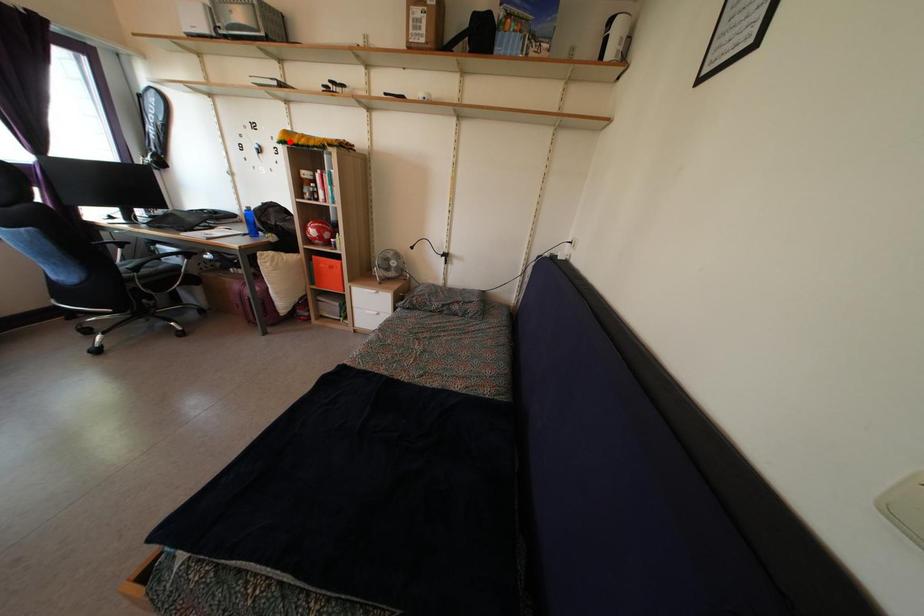
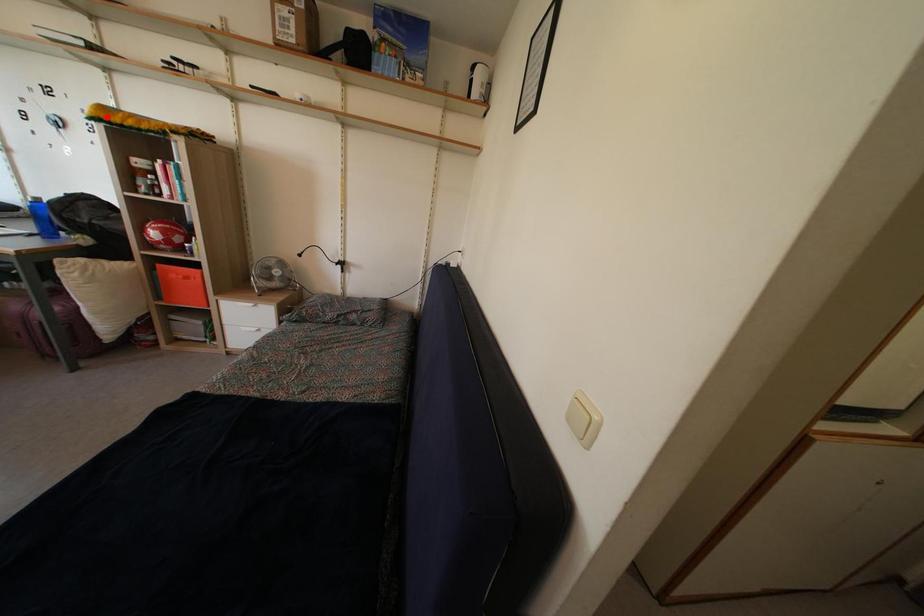
I am providing you with two images of the same scene from different viewpoints. A red point is marked on the first image and another point is marked on the second image. Is the marked point in image1 the same physical position as the marked point in image2?

Yes